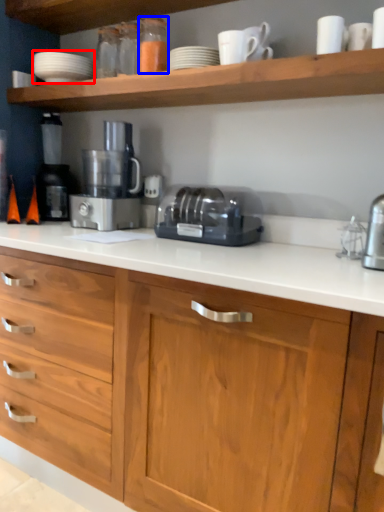
Question: Which object is further to the camera taking this photo, tableware (highlighted by a red box) or bottle (highlighted by a blue box)?

Choices:
 (A) tableware
 (B) bottle

Answer: (A)